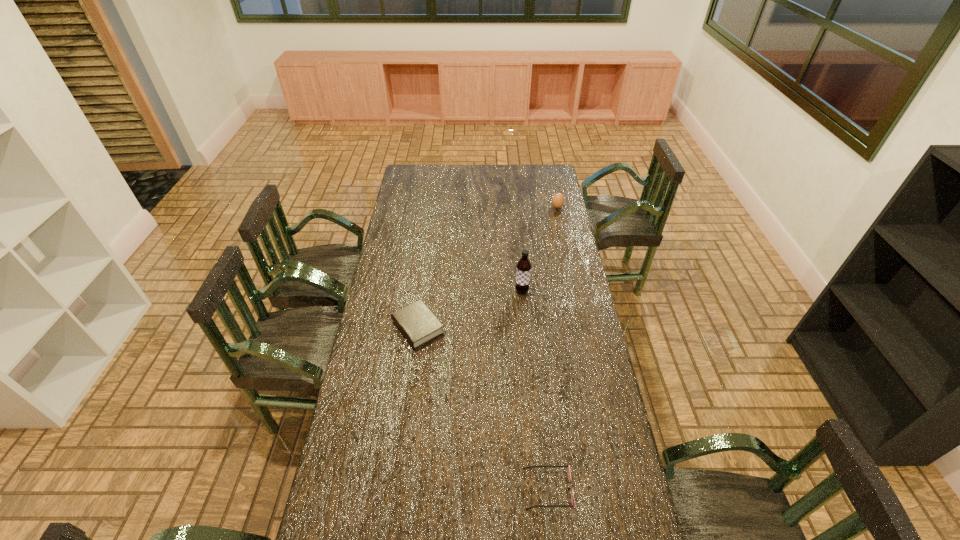
Identify the location of object that can be found as the third closest to the farthest object. (568, 467).

Locate which object ranks third in proximity to the shortest object. Please provide its 2D coordinates. Your answer should be formatted as a tuple, i.e. [(x, y)], where the tuple contains the x and y coordinates of a point satisfying the conditions above.

[(558, 200)]